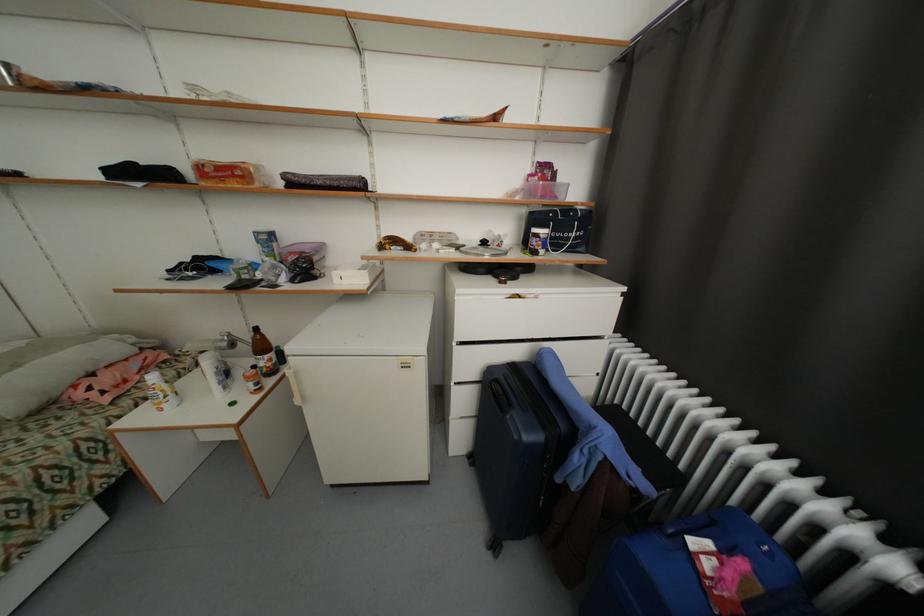
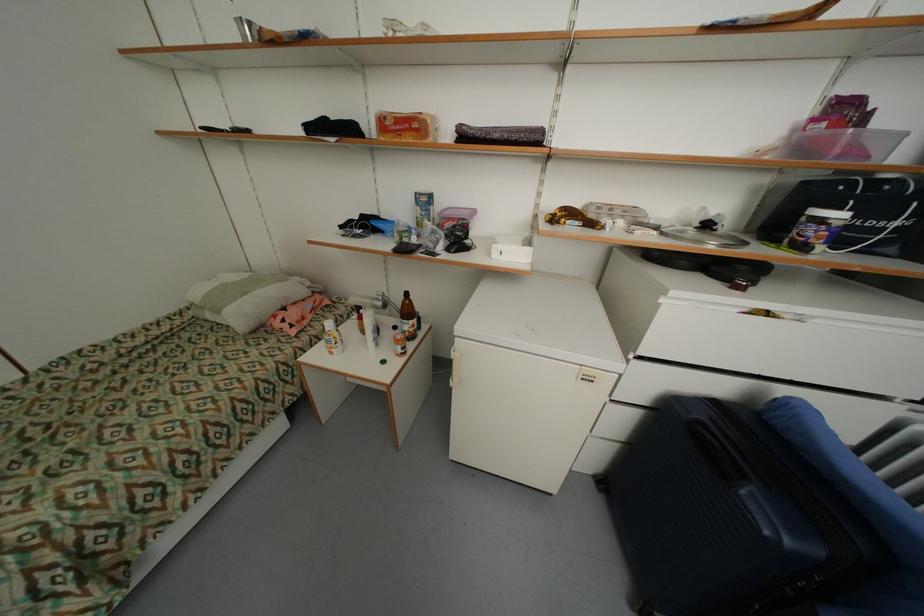
Find the pixel in the second image that matches (268,363) in the first image.

(411, 329)